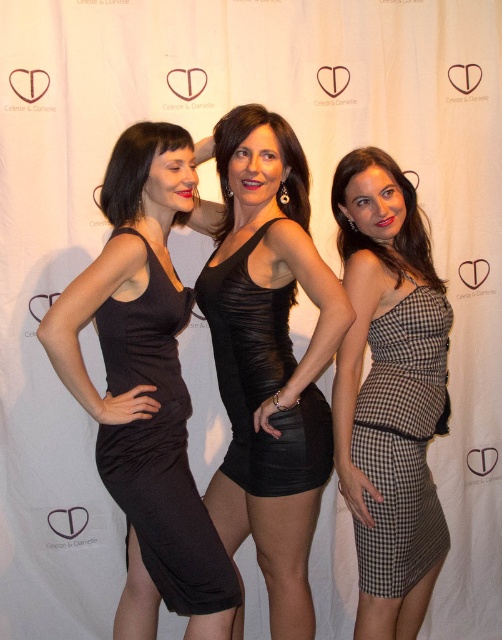
Is matte black dress at center positioned at the back of checkered fabric dress at right?

No, it is not.

Between point (136, 572) and point (365, 419), which one is positioned behind?

Point (136, 572)

I want to click on matte black dress at center, so click(146, 388).

I want to click on matte black dress at center, so click(146, 388).

Does point (229, 264) come farther from viewer compared to point (115, 204)?

Yes, point (229, 264) is farther from viewer.

Can you confirm if shiny black dress at center is positioned to the right of matte black dress at center?

Correct, you'll find shiny black dress at center to the right of matte black dress at center.

This screenshot has height=640, width=502. Find the location of `shiny black dress at center`. shiny black dress at center is located at coordinates (268, 355).

You are a GUI agent. You are given a task and a screenshot of the screen. Output one action in this format:
    pyautogui.click(x=<x>, y=<y>)
    Task: Click on the shiny black dress at center
    The height and width of the screenshot is (640, 502).
    Given the screenshot: What is the action you would take?
    pyautogui.click(x=268, y=355)

Is shiny black dress at center further to camera compared to checkered fabric dress at right?

That is False.

Can you confirm if shiny black dress at center is thinner than checkered fabric dress at right?

Incorrect, shiny black dress at center's width is not less than checkered fabric dress at right's.

Who is more distant from viewer, [286,547] or [443,410]?

Point [443,410]

This screenshot has width=502, height=640. In order to click on shiny black dress at center in this screenshot , I will do `click(268, 355)`.